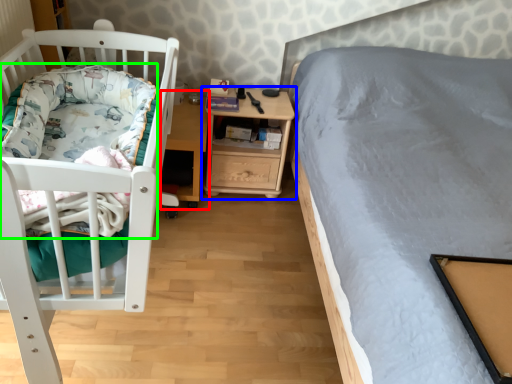
Question: Which object is the closest to the table (highlighted by a red box)? Choose among these: nightstand (highlighted by a blue box) or blanket (highlighted by a green box).

Choices:
 (A) nightstand
 (B) blanket

Answer: (A)